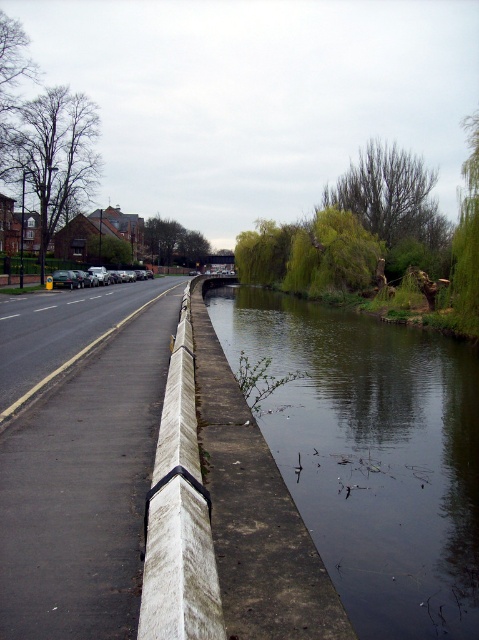
Question: Which of the following is the closest to the observer?

Choices:
 (A) white concrete curb at center
 (B) dark reflective water at center

Answer: (A)

Question: Is dark reflective water at center to the left of white concrete curb at center from the viewer's perspective?

Choices:
 (A) yes
 (B) no

Answer: (B)

Question: Which object is closer to the camera taking this photo?

Choices:
 (A) dark reflective water at center
 (B) white concrete curb at center

Answer: (B)

Question: Is dark reflective water at center closer to the viewer compared to white concrete curb at center?

Choices:
 (A) yes
 (B) no

Answer: (B)

Question: Does dark reflective water at center appear on the left side of white concrete curb at center?

Choices:
 (A) yes
 (B) no

Answer: (B)